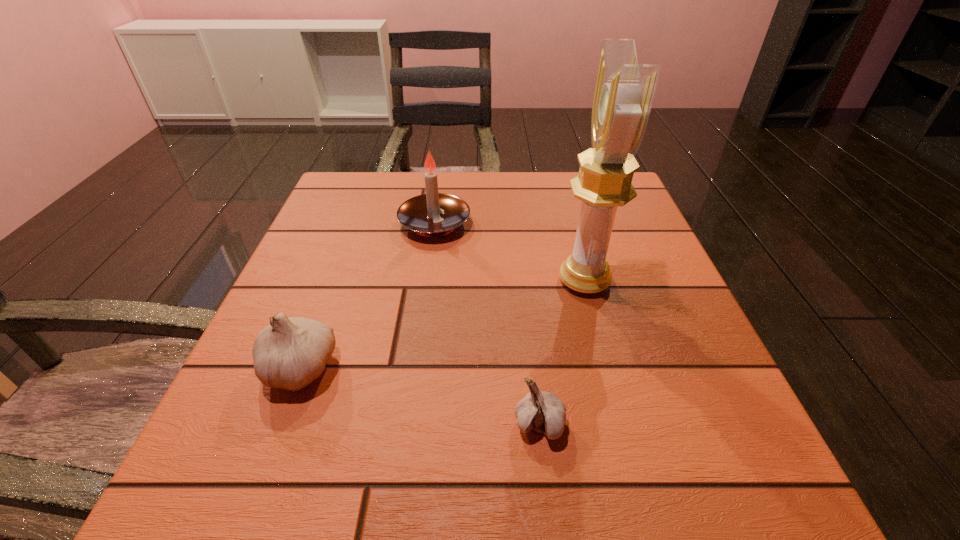
The height and width of the screenshot is (540, 960). I want to click on vacant space that's between the farther garlic and the tallest object, so coord(442,324).

Find the location of a particular element. Image resolution: width=960 pixels, height=540 pixels. free space between the second nearest object and the shorter garlic is located at coordinates (420, 396).

Where is `vacant area that lies between the farther garlic and the candle`? vacant area that lies between the farther garlic and the candle is located at coordinates (367, 295).

I want to click on vacant area that lies between the nearest object and the farther garlic, so (420, 396).

Locate an element on the screen. Image resolution: width=960 pixels, height=540 pixels. free space between the second nearest object and the award is located at coordinates (442, 324).

Select which object appears as the closest to the farthest object. Please provide its 2D coordinates. Your answer should be formatted as a tuple, i.e. [(x, y)], where the tuple contains the x and y coordinates of a point satisfying the conditions above.

[(624, 91)]

Find the location of a particular element. object that is the second closest to the leftmost object is located at coordinates (544, 412).

Locate an element on the screen. Image resolution: width=960 pixels, height=540 pixels. free spot that satisfies the following two spatial constraints: 1. on the front-facing side of the tallest object; 2. on the front side of the shortest object is located at coordinates (623, 424).

This screenshot has width=960, height=540. I want to click on free space that satisfies the following two spatial constraints: 1. on the front-facing side of the tallest object; 2. on the front side of the shortest object, so click(x=623, y=424).